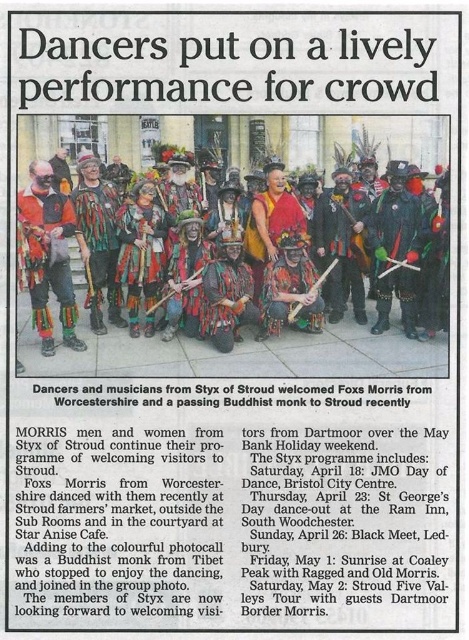
You are a photographer standing at the back of the crowd watching the performance. You want to take a clear photo of the matte multicolored costume at center. Considering your camera has a maximum focus range of 80 feet, will you be able to capture the costume clearly?

The matte multicolored costume at center is 82.74 feet away from the camera. Since the camera can only focus up to 80 feet, it won

You are a photographer who wants to capture a clear photo of both the matte multicolored costume at center and the orange fabric mask at left. However, your camera can only focus on one object at a time. Which object should you focus on to ensure the other remains visible in the background?

You should focus on the matte multicolored costume at center because it is positioned over the orange fabric mask at left, meaning the orange fabric mask at left will be in the background and still visible.